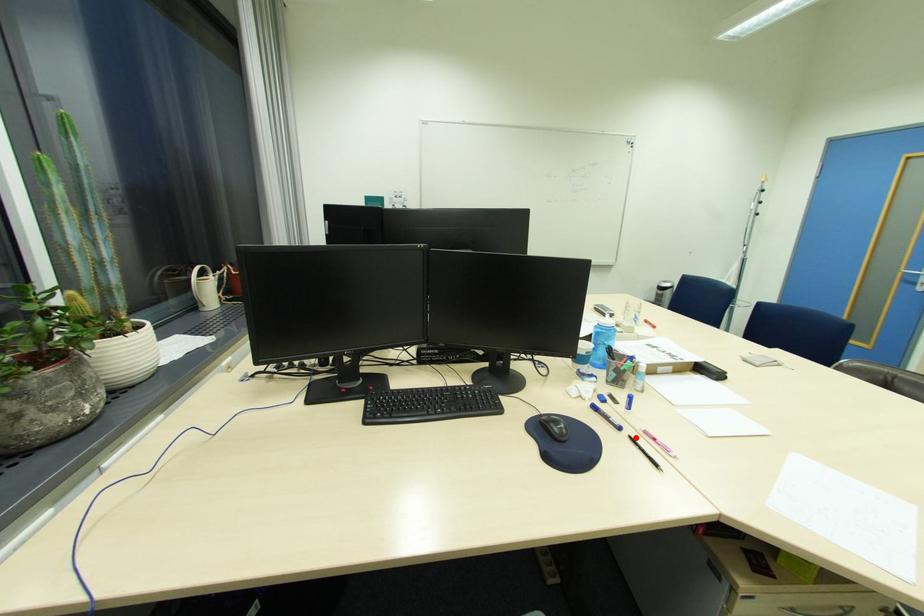
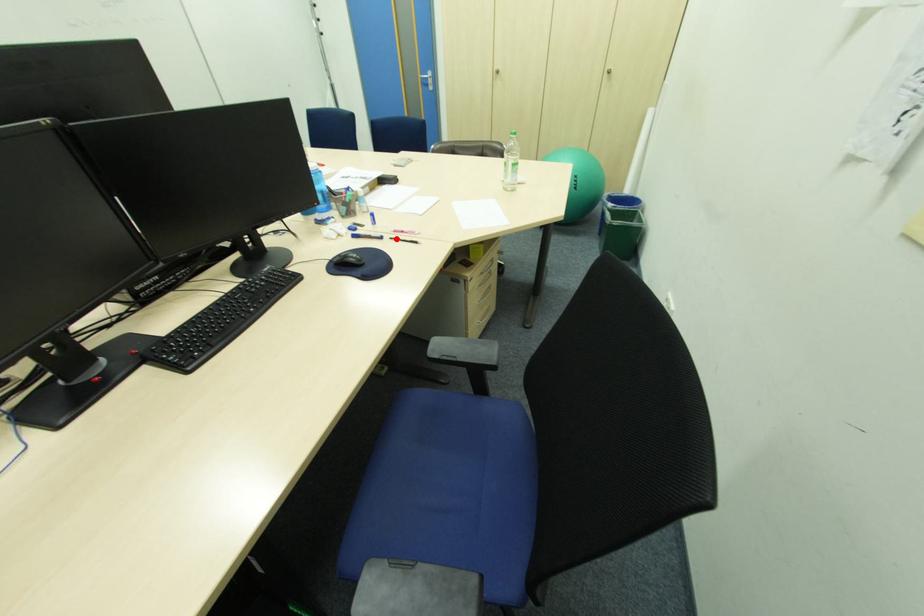
I am providing you with two images of the same scene from different viewpoints. A red point is marked on the first image and another point is marked on the second image. Does the point marked in image1 correspond to the same location as the one in image2?

Yes